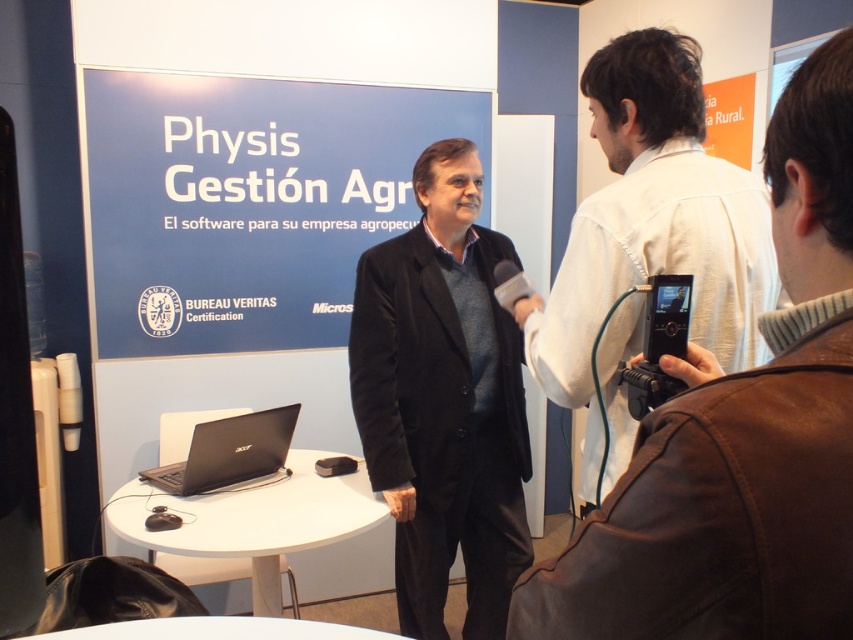
Which is above, white shirt at center or black matte laptop at lower left?

Positioned higher is white shirt at center.

Between point (682, 177) and point (218, 460), which one is positioned in front?

Point (682, 177)

The width and height of the screenshot is (853, 640). Find the location of `white shirt at center`. white shirt at center is located at coordinates (653, 225).

Looking at this image, between black velvet blazer at center and white shirt at center, which one appears on the left side from the viewer's perspective?

black velvet blazer at center

Can you confirm if black velvet blazer at center is smaller than white shirt at center?

Correct, black velvet blazer at center occupies less space than white shirt at center.

Which is in front, point (492, 342) or point (711, 204)?

Point (711, 204) is more forward.

At what (x,y) coordinates should I click in order to perform the action: click on black velvet blazer at center. Please return your answer as a coordinate pair (x, y). Image resolution: width=853 pixels, height=640 pixels. Looking at the image, I should click on (444, 420).

Is black velvet blazer at center further to camera compared to black matte laptop at lower left?

Yes, black velvet blazer at center is behind black matte laptop at lower left.

Between black velvet blazer at center and black matte laptop at lower left, which one appears on the left side from the viewer's perspective?

black matte laptop at lower left

Based on the photo, who is more distant from viewer, (453, 369) or (285, 445)?

The point (285, 445) is more distant.

I want to click on black velvet blazer at center, so pyautogui.click(x=444, y=420).